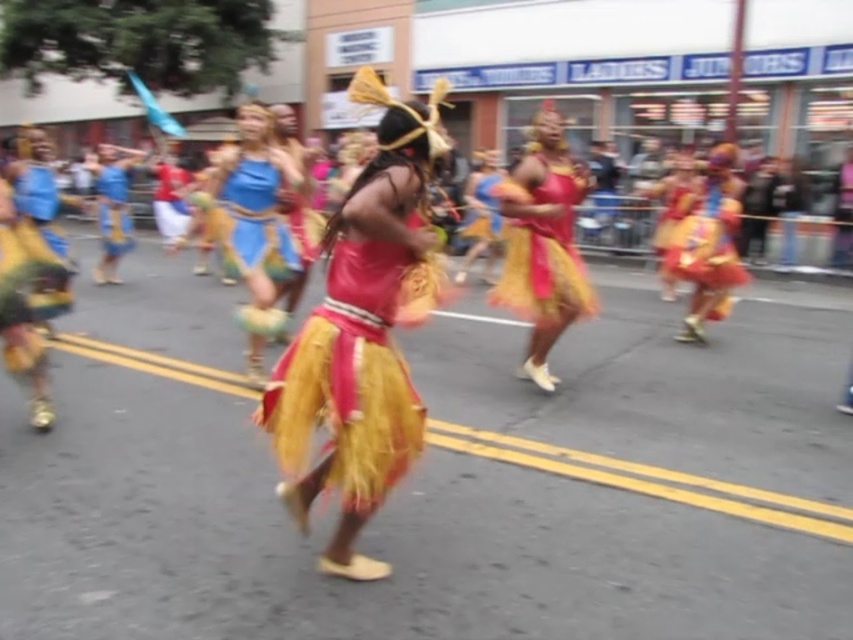
From the picture: Which is above, shiny gold skirt at center or matte blue fabric skirt at left?

matte blue fabric skirt at left

Does shiny gold skirt at center have a larger size compared to matte blue fabric skirt at left?

Incorrect, shiny gold skirt at center is not larger than matte blue fabric skirt at left.

The width and height of the screenshot is (853, 640). I want to click on shiny gold skirt at center, so click(x=543, y=250).

Identify the location of shiny gold skirt at center. The height and width of the screenshot is (640, 853). (543, 250).

Between shiny metallic skirt at center and matte blue fabric skirt at left, which one is positioned higher?

matte blue fabric skirt at left is higher up.

Is shiny metallic skirt at center smaller than matte blue fabric skirt at left?

Correct, shiny metallic skirt at center occupies less space than matte blue fabric skirt at left.

What are the coordinates of `shiny metallic skirt at center` in the screenshot? It's located at tap(706, 240).

Can you confirm if shiny red fabric skirt at center is positioned to the left of shiny metallic skirt at center?

Correct, you'll find shiny red fabric skirt at center to the left of shiny metallic skirt at center.

Is shiny red fabric skirt at center closer to camera compared to shiny metallic skirt at center?

That is True.

The height and width of the screenshot is (640, 853). What are the coordinates of `shiny red fabric skirt at center` in the screenshot? It's located at (357, 353).

Image resolution: width=853 pixels, height=640 pixels. Find the location of `shiny red fabric skirt at center`. shiny red fabric skirt at center is located at coordinates (357, 353).